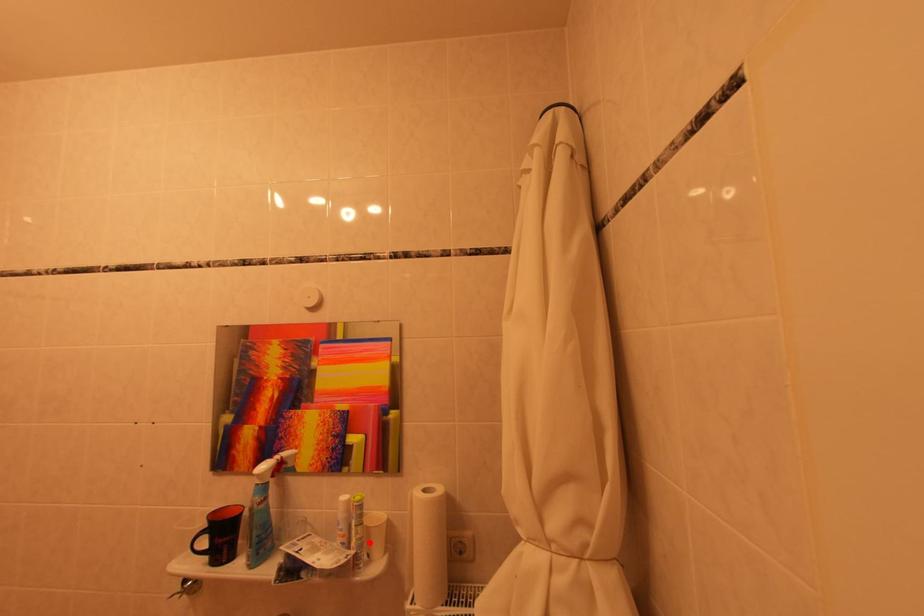
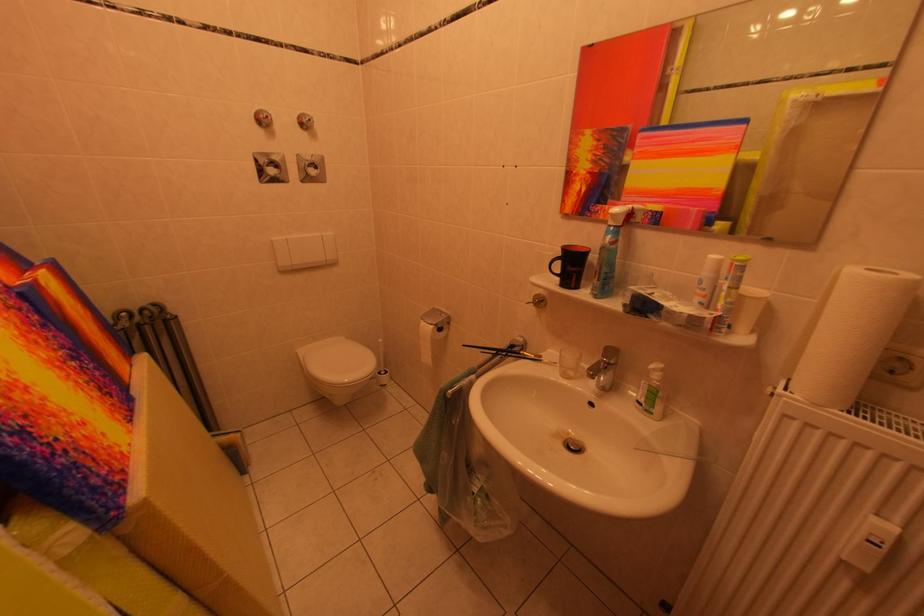
Where in the second image is the point corresponding to the highlighted location from the first image?

(739, 307)